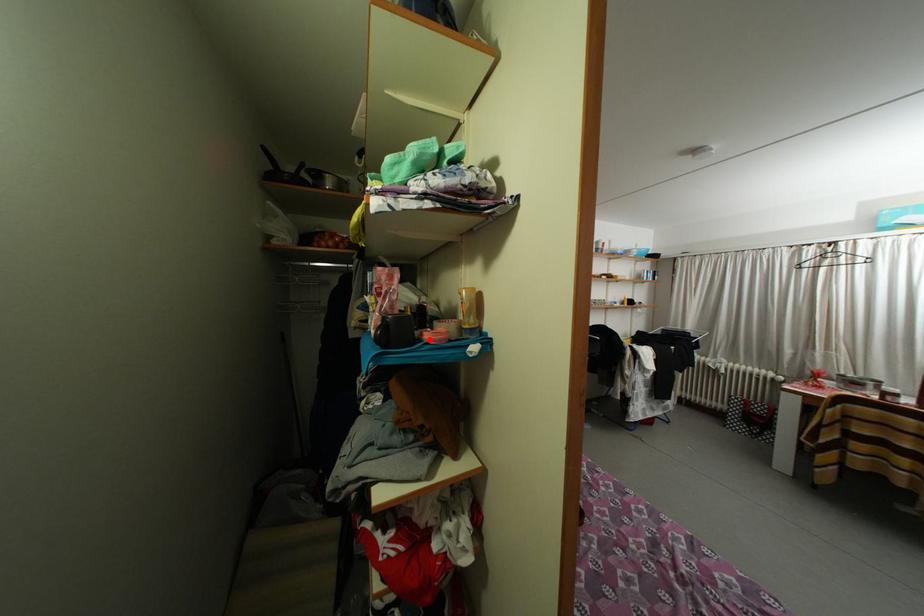
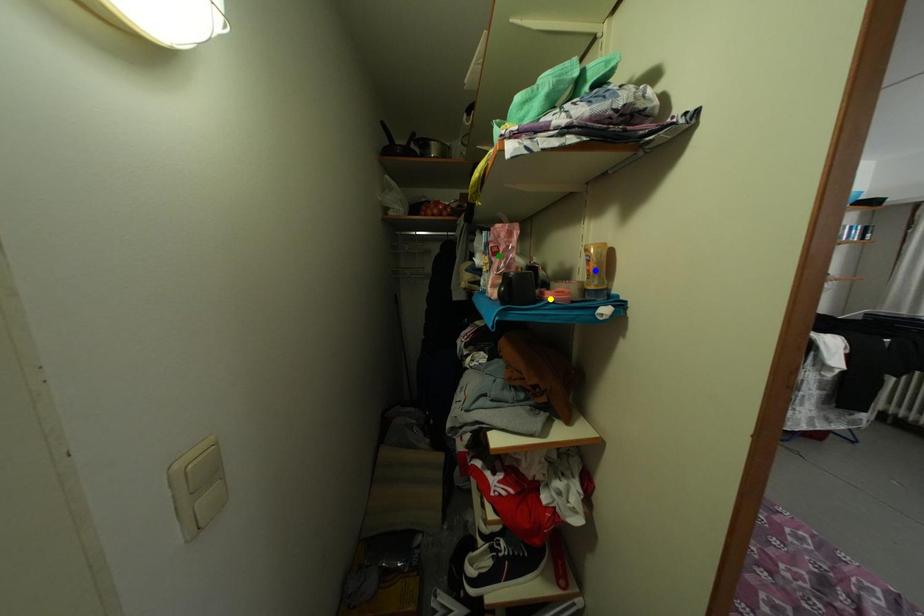
Question: I am providing you with two images of the same scene from different viewpoints. A red point is marked on the first image. You are given multiple points on the second image. Can you choose the point in image 2 that corresponds to the point in image 1?

Choices:
 (A) blue point
 (B) yellow point
 (C) green point

Answer: (B)